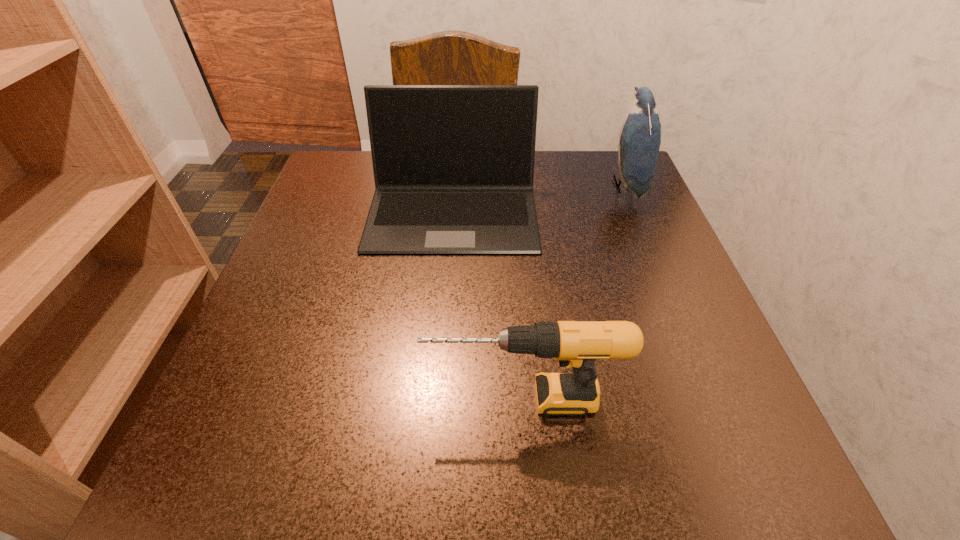
The height and width of the screenshot is (540, 960). What are the coordinates of `vacant position located 0.110m on the handle side of the shortest object` in the screenshot? It's located at (348, 399).

Locate an element on the screen. This screenshot has width=960, height=540. laptop that is at the far edge is located at coordinates (453, 165).

The image size is (960, 540). In order to click on bird located in the far edge section of the desktop in this screenshot , I will do `click(640, 136)`.

Where is `object at the left edge`? The height and width of the screenshot is (540, 960). object at the left edge is located at coordinates (453, 165).

Identify the location of object located at the right edge. This screenshot has width=960, height=540. (640, 136).

Find the location of a particular element. This screenshot has width=960, height=540. object that is positioned at the far left corner is located at coordinates (453, 165).

This screenshot has width=960, height=540. In order to click on object that is at the far right corner in this screenshot , I will do `click(640, 136)`.

In the image, there is a desktop. Where is `vacant space at the near edge`? vacant space at the near edge is located at coordinates (612, 433).

Find the location of `vacant space at the right edge of the desktop`. vacant space at the right edge of the desktop is located at coordinates (724, 408).

I want to click on vacant area at the far left corner of the desktop, so click(329, 202).